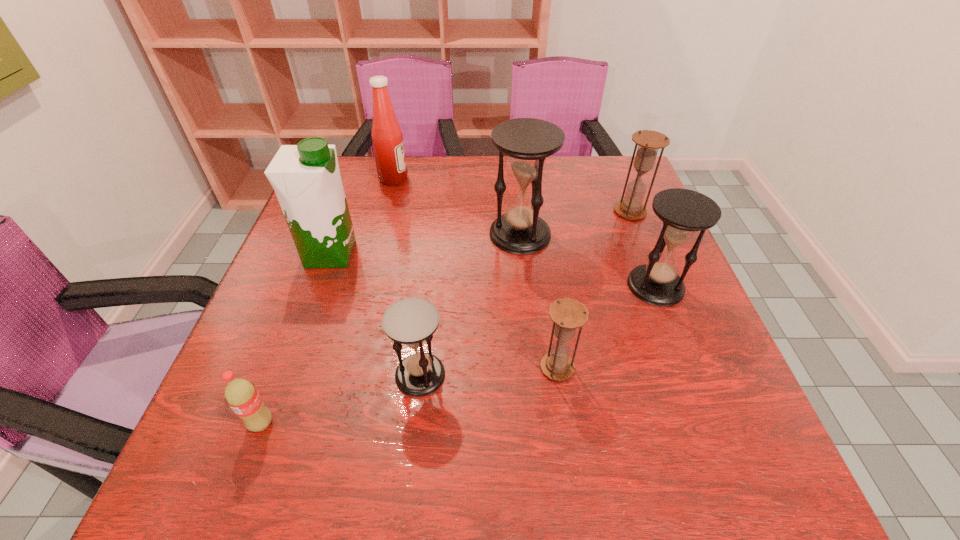
Locate an element on the screen. the left brown hourglass is located at coordinates (567, 314).

This screenshot has height=540, width=960. I want to click on the leftmost black hourglass, so click(x=411, y=321).

This screenshot has height=540, width=960. What are the coordinates of `the fourth object from left to right` in the screenshot? It's located at (411, 321).

Locate an element on the screen. The height and width of the screenshot is (540, 960). red soda is located at coordinates (241, 395).

This screenshot has width=960, height=540. I want to click on the nearest object, so click(241, 395).

Where is `free location located 0.290m on the front-facing side of the farthest object`? The width and height of the screenshot is (960, 540). free location located 0.290m on the front-facing side of the farthest object is located at coordinates (507, 179).

Where is `free space located on the front-facing side of the green soya milk`? free space located on the front-facing side of the green soya milk is located at coordinates (412, 254).

You are a GUI agent. You are given a task and a screenshot of the screen. Output one action in this format:
    pyautogui.click(x=<x>, y=<y>)
    Task: Click on the vacant region located on the left of the farthest black hourglass
    
    Given the screenshot: What is the action you would take?
    pyautogui.click(x=354, y=234)

Image resolution: width=960 pixels, height=540 pixels. I want to click on vacant space located on the back of the rightmost black hourglass, so pyautogui.click(x=641, y=249).

I want to click on free space located on the front of the right brown hourglass, so click(x=670, y=313).